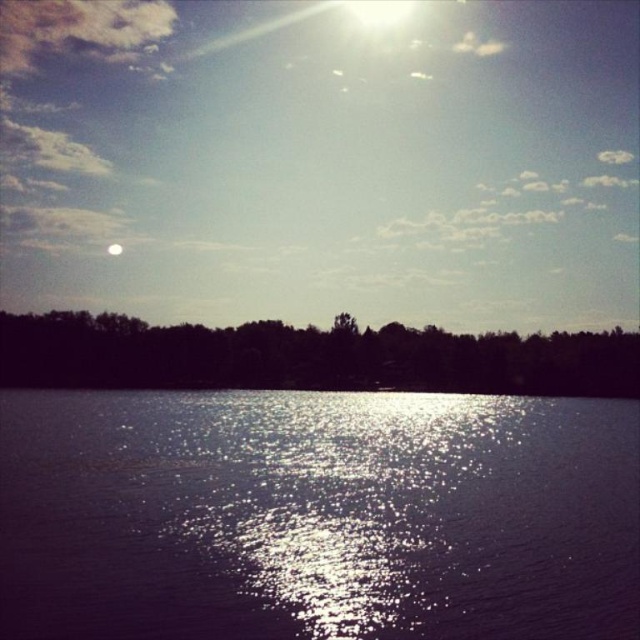
Based on the photo, you are standing at the center of the image and want to locate the silhouette leafy trees at center. According to the coordinates provided, in which direction should you look to find them?

The silhouette leafy trees at center are located at coordinates point (308, 356). Since you are at the center of the image, which is point (320, 320), the trees are slightly to the left and below your current position. Therefore, you should look slightly to the left and downward to find them.

You are an artist trying to capture the reflection of the sun on the water. You see the glistening reflective water at center and the silhouette leafy trees at center. Which object is closer to the left edge of your canvas?

The glistening reflective water at center is positioned on the left side of silhouette leafy trees at center, so it is closer to the left edge of the canvas.

You are standing at the edge of the lake and see the point marked at coordinate (316, 516). Based on the scene description, what is the most likely feature at that location?

The point at coordinate (316, 516) corresponds to glistening reflective water at center.